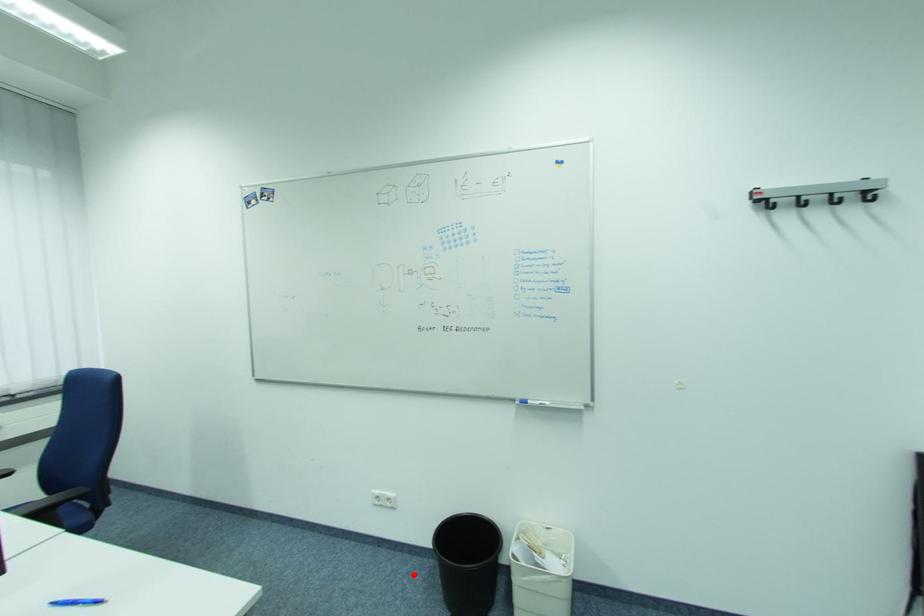
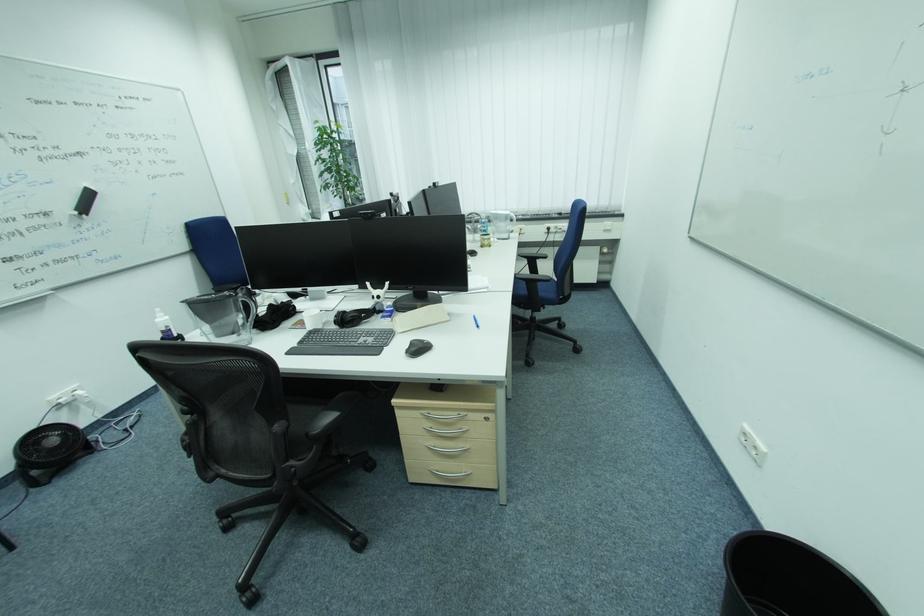
Question: A red point is marked in image1. In image2, is the corresponding 3D point closer to the camera or farther? Reply with the corresponding letter.

Choices:
 (A) The corresponding 3D point is closer.
 (B) The corresponding 3D point is farther.

Answer: (B)